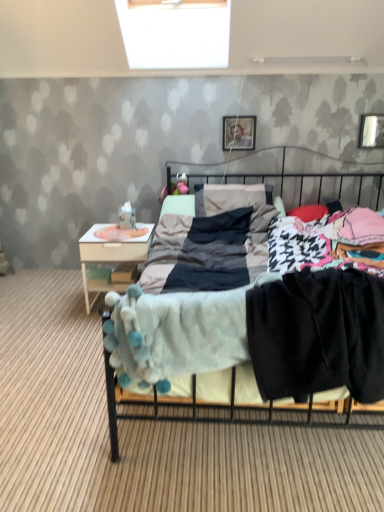
Question: From the image's perspective, is black cotton pants at lower right below soft gray blanket at center?

Choices:
 (A) no
 (B) yes

Answer: (B)

Question: Does black cotton pants at lower right lie in front of soft gray blanket at center?

Choices:
 (A) no
 (B) yes

Answer: (A)

Question: Does black cotton pants at lower right have a lesser width compared to soft gray blanket at center?

Choices:
 (A) yes
 (B) no

Answer: (A)

Question: From a real-world perspective, is black cotton pants at lower right physically below soft gray blanket at center?

Choices:
 (A) no
 (B) yes

Answer: (A)

Question: Can soft gray blanket at center be found inside black cotton pants at lower right?

Choices:
 (A) no
 (B) yes

Answer: (A)

Question: Is white plush toy at upper left to the left or to the right of black cotton pants at lower right in the image?

Choices:
 (A) right
 (B) left

Answer: (B)

Question: Considering the positions of point (125, 204) and point (276, 360), is point (125, 204) closer or farther from the camera than point (276, 360)?

Choices:
 (A) farther
 (B) closer

Answer: (A)

Question: From the image's perspective, relative to black cotton pants at lower right, is white plush toy at upper left above or below?

Choices:
 (A) below
 (B) above

Answer: (B)

Question: Based on their sizes in the image, would you say white plush toy at upper left is bigger or smaller than black cotton pants at lower right?

Choices:
 (A) small
 (B) big

Answer: (A)

Question: In the image, is white plush toy at upper left on the left side or the right side of white wood nightstand at left?

Choices:
 (A) right
 (B) left

Answer: (A)

Question: From a real-world perspective, is white plush toy at upper left above or below white wood nightstand at left?

Choices:
 (A) above
 (B) below

Answer: (A)

Question: From the image's perspective, relative to white wood nightstand at left, is white plush toy at upper left above or below?

Choices:
 (A) below
 (B) above

Answer: (B)

Question: Considering the positions of white plush toy at upper left and white wood nightstand at left in the image, is white plush toy at upper left bigger or smaller than white wood nightstand at left?

Choices:
 (A) big
 (B) small

Answer: (B)

Question: Looking at the image, does white wood nightstand at left seem bigger or smaller compared to wooden photo frame at upper center, the 2th picture frame positioned from the right?

Choices:
 (A) big
 (B) small

Answer: (A)

Question: Is white wood nightstand at left wider or thinner than wooden photo frame at upper center, which appears as the first picture frame when viewed from the left?

Choices:
 (A) wide
 (B) thin

Answer: (A)